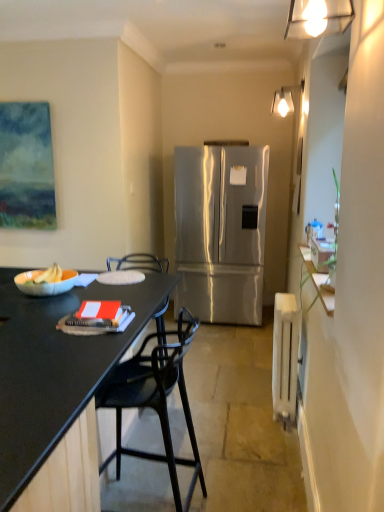
You are a GUI agent. You are given a task and a screenshot of the screen. Output one action in this format:
    pyautogui.click(x=<x>, y=<y>)
    Task: Click on the black matte desk at left
    
    Given the screenshot: What is the action you would take?
    pyautogui.click(x=55, y=369)

This screenshot has width=384, height=512. What do you see at coordinates (285, 99) in the screenshot? I see `matte white light fixture at upper center, the first lamp viewed from the back` at bounding box center [285, 99].

Where is `black plastic chair at left`? The image size is (384, 512). black plastic chair at left is located at coordinates (155, 399).

What do you see at coordinates (155, 399) in the screenshot? I see `black plastic chair at left` at bounding box center [155, 399].

Image resolution: width=384 pixels, height=512 pixels. What do you see at coordinates (221, 231) in the screenshot?
I see `stainless steel refrigerator at center` at bounding box center [221, 231].

Where is `orange matte book at left`? orange matte book at left is located at coordinates (95, 324).

From a real-world perspective, is black matte desk at left physically located above or below matte white bowl at left?

black matte desk at left is situated lower than matte white bowl at left in the real world.

From the image's perspective, does black matte desk at left appear higher than matte white bowl at left?

Incorrect, from the image's perspective, black matte desk at left is lower than matte white bowl at left.

Considering the sizes of black matte desk at left and matte white bowl at left in the image, is black matte desk at left bigger or smaller than matte white bowl at left?

Considering their sizes, black matte desk at left takes up more space than matte white bowl at left.

Measure the distance from black matte desk at left to matte white bowl at left.

black matte desk at left is 15.97 inches from matte white bowl at left.

Is point (279, 103) positioned in front of point (21, 335)?

That is False.

Could you tell me if matte white light fixture at upper center, the second lamp in the bottom-to-top sequence, is turned towards black matte desk at left?

No, matte white light fixture at upper center, the second lamp in the bottom-to-top sequence, is not oriented towards black matte desk at left.

Is matte white light fixture at upper center, the second lamp in the bottom-to-top sequence, outside of black matte desk at left?

matte white light fixture at upper center, the second lamp in the bottom-to-top sequence, is positioned outside black matte desk at left.

From the image's perspective, which is above, white plastic radiator at right or matte white bowl at left?

matte white bowl at left.

Which of these two, white plastic radiator at right or matte white bowl at left, stands shorter?

matte white bowl at left.

Based on the photo, is white plastic radiator at right facing towards matte white bowl at left?

Yes.

Which is further, (133, 385) or (121, 328)?

The point (133, 385) is behind.

From a real-world perspective, between black plastic chair at left and orange matte book at left, who is vertically higher?

orange matte book at left is physically above.

Which is in front, black plastic chair at left or orange matte book at left?

black plastic chair at left is in front.

Is black plastic chair at left oriented away from orange matte book at left?

No, black plastic chair at left's orientation is not away from orange matte book at left.

Between point (15, 382) and point (166, 361), which one is positioned behind?

The point (166, 361) is farther.

Do you think black matte desk at left is within black plastic chair at left, or outside of it?

black matte desk at left cannot be found inside black plastic chair at left.

Considering the sizes of objects black matte desk at left and black plastic chair at left in the image provided, who is shorter, black matte desk at left or black plastic chair at left?

With less height is black matte desk at left.

In terms of size, does black matte desk at left appear bigger or smaller than black plastic chair at left?

black matte desk at left is bigger than black plastic chair at left.

Is matte white light fixture at upper right, the 1th lamp in the left-to-right sequence, aimed at black plastic chair at left?

No, matte white light fixture at upper right, the 1th lamp in the left-to-right sequence, is not oriented towards black plastic chair at left.

From the image's perspective, which one is positioned higher, matte white light fixture at upper right, the 1th lamp in the left-to-right sequence, or black plastic chair at left?

matte white light fixture at upper right, the 1th lamp in the left-to-right sequence, appears higher in the image.

Can you confirm if matte white light fixture at upper right, the 1th lamp in the left-to-right sequence, is bigger than black plastic chair at left?

No.

Which object is closer to the camera taking this photo, matte white light fixture at upper right, placed as the second lamp when sorted from top to bottom, or black plastic chair at left?

matte white light fixture at upper right, placed as the second lamp when sorted from top to bottom, is more forward.

Does point (198, 459) lie in front of point (62, 410)?

No, it is behind (62, 410).

Considering the relative sizes of black plastic chair at left and black matte desk at left in the image provided, is black plastic chair at left taller than black matte desk at left?

Yes.

Is black plastic chair at left facing away from black matte desk at left?

No, black matte desk at left is not at the back of black plastic chair at left.

Considering the sizes of objects black plastic chair at left and black matte desk at left in the image provided, who is wider, black plastic chair at left or black matte desk at left?

Wider between the two is black matte desk at left.

Find the location of a particular element. The width and height of the screenshot is (384, 512). bowl lying behind the black matte desk at left is located at coordinates (45, 283).

I want to click on the 2nd lamp counting from the right side of the black matte desk at left, so click(285, 99).

Looking at this image, when comparing their distances from white plastic radiator at right, does matte white bowl at left or matte white light fixture at upper right, which is the first lamp in front-to-back order, seem closer?

matte white bowl at left is positioned closer to the anchor white plastic radiator at right.

Looking at the image, which one is located further to stainless steel refrigerator at center, black matte desk at left or matte white bowl at left?

Among the two, matte white bowl at left is located further to stainless steel refrigerator at center.

Considering their positions, is stainless steel refrigerator at center positioned further to white plastic radiator at right than matte white bowl at left?

stainless steel refrigerator at center is positioned further to the anchor white plastic radiator at right.

From the picture: Based on their spatial positions, is stainless steel refrigerator at center or orange matte book at left further from matte white light fixture at upper right, the 1th lamp when ordered from bottom to top?

Among the two, stainless steel refrigerator at center is located further to matte white light fixture at upper right, the 1th lamp when ordered from bottom to top.

From the image, which object appears to be nearer to matte white light fixture at upper right, which is the second lamp in right-to-left order, matte white bowl at left or matte white light fixture at upper center, the 1th lamp viewed from the right?

matte white bowl at left lies closer to matte white light fixture at upper right, which is the second lamp in right-to-left order, than the other object.

Looking at the image, which one is located closer to stainless steel refrigerator at center, matte white light fixture at upper right, the 2th lamp from the back, or black matte desk at left?

black matte desk at left.

When comparing their distances from matte white bowl at left, does white plastic radiator at right or stainless steel refrigerator at center seem closer?

Based on the image, white plastic radiator at right appears to be nearer to matte white bowl at left.

Which object lies nearer to the anchor point black plastic chair at left, matte white light fixture at upper right, placed as the second lamp when sorted from top to bottom, or stainless steel refrigerator at center?

matte white light fixture at upper right, placed as the second lamp when sorted from top to bottom, lies closer to black plastic chair at left than the other object.

At what (x,y) coordinates should I click in order to perform the action: click on bowl between matte white light fixture at upper center, the 1th lamp in the top-to-bottom sequence, and black plastic chair at left in the up-down direction. Please return your answer as a coordinate pair (x, y). Looking at the image, I should click on (45, 283).

This screenshot has width=384, height=512. Find the location of `desk located between matte white light fixture at upper right, the 2th lamp from the back, and stainless steel refrigerator at center in the depth direction`. desk located between matte white light fixture at upper right, the 2th lamp from the back, and stainless steel refrigerator at center in the depth direction is located at coordinates pyautogui.click(x=55, y=369).

Find the location of a particular element. chair located between black matte desk at left and white plastic radiator at right in the left-right direction is located at coordinates (155, 399).

At what (x,y) coordinates should I click in order to perform the action: click on book between matte white light fixture at upper right, the 2th lamp from the back, and stainless steel refrigerator at center from front to back. Please return your answer as a coordinate pair (x, y). Looking at the image, I should click on (95, 324).